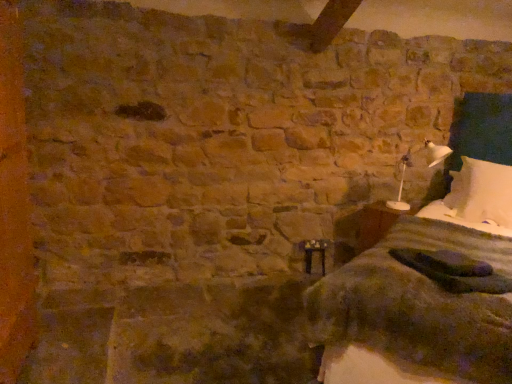
Question: From the image's perspective, is white soft pillow at right above white cotton bed at right?

Choices:
 (A) yes
 (B) no

Answer: (A)

Question: Is white soft pillow at right directly adjacent to white cotton bed at right?

Choices:
 (A) no
 (B) yes

Answer: (A)

Question: Is white soft pillow at right positioned behind white cotton bed at right?

Choices:
 (A) yes
 (B) no

Answer: (A)

Question: From a real-world perspective, is white soft pillow at right positioned over white cotton bed at right based on gravity?

Choices:
 (A) no
 (B) yes

Answer: (B)

Question: Is white soft pillow at right facing away from white cotton bed at right?

Choices:
 (A) no
 (B) yes

Answer: (B)

Question: Is white soft pillow at right shorter than white cotton bed at right?

Choices:
 (A) no
 (B) yes

Answer: (B)

Question: Is white plastic lamp at right next to white soft pillow at right?

Choices:
 (A) yes
 (B) no

Answer: (B)

Question: Can you confirm if white plastic lamp at right is thinner than white soft pillow at right?

Choices:
 (A) no
 (B) yes

Answer: (A)

Question: Considering the relative positions of white plastic lamp at right and white soft pillow at right in the image provided, is white plastic lamp at right to the left of white soft pillow at right from the viewer's perspective?

Choices:
 (A) yes
 (B) no

Answer: (A)

Question: Is white plastic lamp at right further to the viewer compared to white soft pillow at right?

Choices:
 (A) no
 (B) yes

Answer: (A)

Question: Is white plastic lamp at right oriented towards white soft pillow at right?

Choices:
 (A) no
 (B) yes

Answer: (A)

Question: From a real-world perspective, is white plastic lamp at right over white soft pillow at right?

Choices:
 (A) no
 (B) yes

Answer: (B)

Question: Could you tell me if white cotton bed at right is turned towards wooden bedside table at lower right?

Choices:
 (A) no
 (B) yes

Answer: (A)